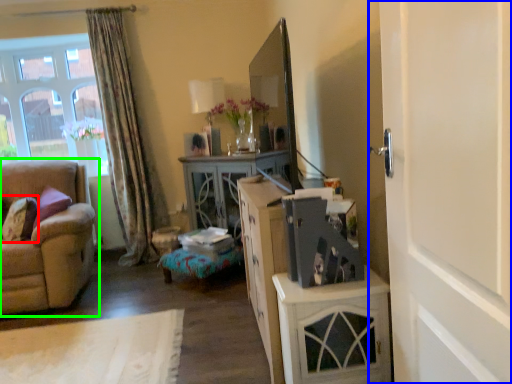
Question: Which object is the farthest from pillow (highlighted by a red box)? Choose among these: door (highlighted by a blue box) or studio couch (highlighted by a green box).

Choices:
 (A) door
 (B) studio couch

Answer: (A)